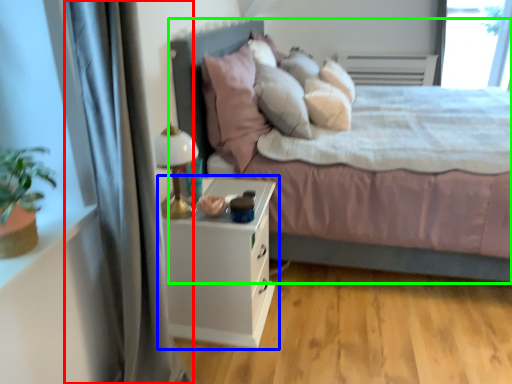
Question: Based on their relative distances, which object is nearer to curtain (highlighted by a red box)? Choose from nightstand (highlighted by a blue box) and bed (highlighted by a green box).

Choices:
 (A) nightstand
 (B) bed

Answer: (A)